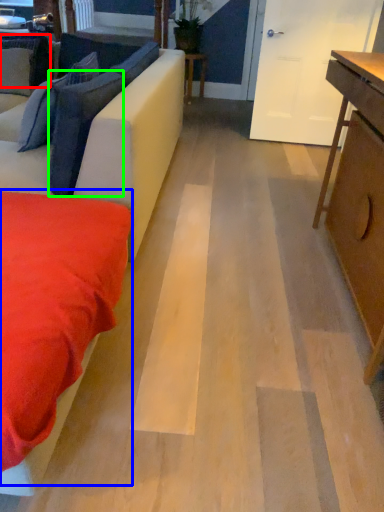
Question: Considering the real-world distances, which object is closest to pillow (highlighted by a red box)? bedding (highlighted by a blue box) or pillow (highlighted by a green box).

Choices:
 (A) bedding
 (B) pillow

Answer: (B)